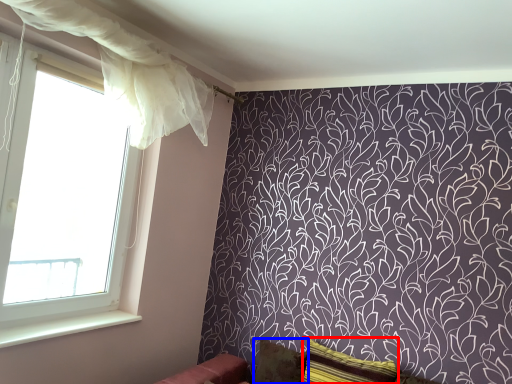
Question: Which object is closer to the camera taking this photo, pillow (highlighted by a red box) or pillow (highlighted by a blue box)?

Choices:
 (A) pillow
 (B) pillow

Answer: (A)